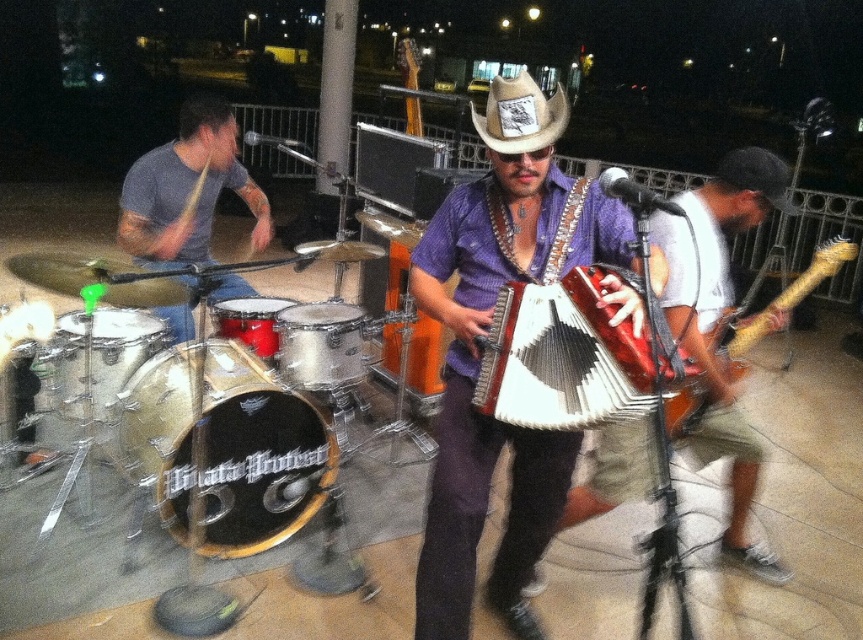
Which is behind, point (114, 365) or point (725, 323)?

The point (114, 365) is more distant.

Is brushed metal drum at left closer to camera compared to wooden electric guitar at right?

No, it is not.

Where is `brushed metal drum at left`? brushed metal drum at left is located at coordinates (120, 349).

Locate an element on the screen. This screenshot has width=863, height=640. brushed metal drum at center is located at coordinates [x=320, y=344].

This screenshot has height=640, width=863. In order to click on brushed metal drum at center in this screenshot , I will do [320, 344].

Locate an element on the screen. brushed metal drum at center is located at coordinates (320, 344).

Does matte purple shirt at center have a smaller size compared to wooden electric guitar at right?

No, matte purple shirt at center is not smaller than wooden electric guitar at right.

Is point (742, 497) positioned behind point (696, 408)?

Yes, point (742, 497) is behind point (696, 408).

Describe the element at coordinates (713, 349) in the screenshot. I see `matte purple shirt at center` at that location.

Locate an element on the screen. matte purple shirt at center is located at coordinates (713, 349).